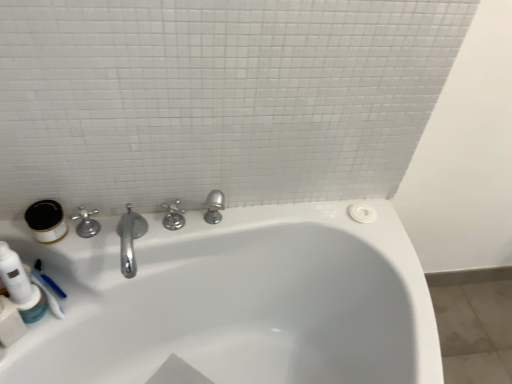
Question: Is polished chrome faucet at left, which ranks as the first tap in left-to-right order, to the right of matte white jar at left, the 2th mouthwash positioned from the bottom, from the viewer's perspective?

Choices:
 (A) no
 (B) yes

Answer: (B)

Question: Does polished chrome faucet at left, placed as the 2th tap when sorted from right to left, turn towards matte white jar at left, the 2th mouthwash positioned from the bottom?

Choices:
 (A) yes
 (B) no

Answer: (B)

Question: Can you confirm if polished chrome faucet at left, placed as the 2th tap when sorted from right to left, is positioned to the left of matte white jar at left, the 1th mouthwash positioned from the top?

Choices:
 (A) no
 (B) yes

Answer: (A)

Question: Can we say polished chrome faucet at left, which ranks as the first tap in left-to-right order, lies outside matte white jar at left, the 1th mouthwash positioned from the top?

Choices:
 (A) no
 (B) yes

Answer: (B)

Question: From a real-world perspective, is polished chrome faucet at left, placed as the 2th tap when sorted from right to left, on matte white jar at left, the 2th mouthwash positioned from the bottom?

Choices:
 (A) yes
 (B) no

Answer: (B)

Question: Can matte white jar at left, the 1th mouthwash positioned from the top, be found inside polished chrome faucet at left, which ranks as the first tap in left-to-right order?

Choices:
 (A) yes
 (B) no

Answer: (B)

Question: Considering the relative sizes of polished chrome faucet at center, which is the 1th tap in right-to-left order, and translucent plastic mouthwash at lower left, arranged as the 2th mouthwash when viewed from the top, in the image provided, is polished chrome faucet at center, which is the 1th tap in right-to-left order, smaller than translucent plastic mouthwash at lower left, arranged as the 2th mouthwash when viewed from the top,?

Choices:
 (A) no
 (B) yes

Answer: (A)

Question: Is polished chrome faucet at center, which is counted as the 2th tap, starting from the left, placed right next to translucent plastic mouthwash at lower left, which ranks as the 1th mouthwash in bottom-to-top order?

Choices:
 (A) no
 (B) yes

Answer: (A)

Question: Can you confirm if polished chrome faucet at center, which is counted as the 2th tap, starting from the left, is taller than translucent plastic mouthwash at lower left, arranged as the 2th mouthwash when viewed from the top?

Choices:
 (A) yes
 (B) no

Answer: (A)

Question: Is polished chrome faucet at center, which is the 1th tap in right-to-left order, thinner than translucent plastic mouthwash at lower left, arranged as the 2th mouthwash when viewed from the top?

Choices:
 (A) yes
 (B) no

Answer: (A)

Question: Can you confirm if polished chrome faucet at center, which is counted as the 2th tap, starting from the left, is positioned to the right of translucent plastic mouthwash at lower left, arranged as the 2th mouthwash when viewed from the top?

Choices:
 (A) yes
 (B) no

Answer: (A)

Question: Does polished chrome faucet at center, which is counted as the 2th tap, starting from the left, come in front of translucent plastic mouthwash at lower left, which ranks as the 1th mouthwash in bottom-to-top order?

Choices:
 (A) no
 (B) yes

Answer: (A)

Question: Is polished chrome faucet at left, which ranks as the first tap in left-to-right order, outside white glossy bathtub at center?

Choices:
 (A) no
 (B) yes

Answer: (B)